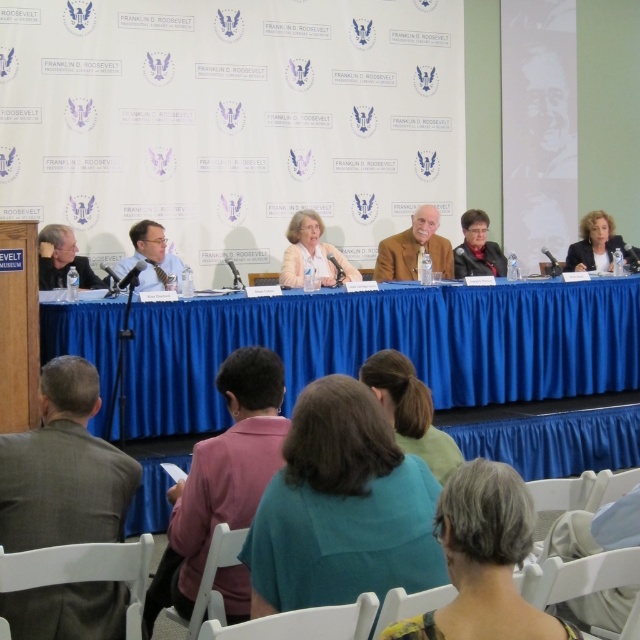
Does teal fabric shirt at center have a larger size compared to matte black jacket at upper right?

No.

Between teal fabric shirt at center and matte black jacket at upper right, which one appears on the right side from the viewer's perspective?

Positioned to the right is matte black jacket at upper right.

Which is behind, point (268, 573) or point (612, 221)?

Point (612, 221)

Where is `teal fabric shirt at center`? teal fabric shirt at center is located at coordinates (340, 508).

Consider the image. Does gray textured hair at center come in front of light pink fabric jacket at center?

Yes, gray textured hair at center is in front of light pink fabric jacket at center.

Is point (483, 472) less distant than point (321, 224)?

Yes, it is in front of point (321, 224).

Identify the location of gray textured hair at center. (x=483, y=561).

Which of these two, gray textured hair at center or matte black jacket at upper right, stands shorter?

gray textured hair at center is shorter.

Can you confirm if gray textured hair at center is positioned below matte black jacket at upper right?

Indeed, gray textured hair at center is positioned under matte black jacket at upper right.

Does point (403, 624) come behind point (595, 266)?

That is False.

Locate an element on the screen. This screenshot has width=640, height=640. gray textured hair at center is located at coordinates (483, 561).